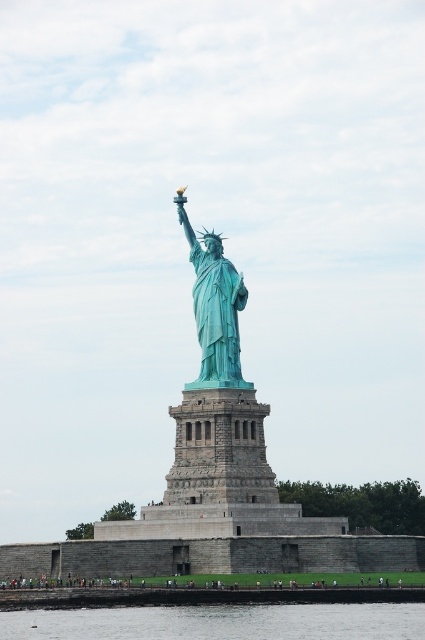
Question: Is clear water at lower center below green patina statue at center?

Choices:
 (A) no
 (B) yes

Answer: (B)

Question: Can you confirm if clear water at lower center is wider than green patina statue at center?

Choices:
 (A) yes
 (B) no

Answer: (A)

Question: Does clear water at lower center appear on the left side of green patina statue at center?

Choices:
 (A) no
 (B) yes

Answer: (B)

Question: Which of the following is the farthest from the observer?

Choices:
 (A) (207, 612)
 (B) (235, 301)

Answer: (B)